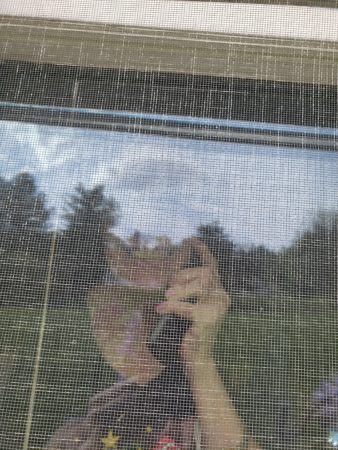
You are a GUI agent. You are given a task and a screenshot of the screen. Output one action in this format:
    pyautogui.click(x=<x>, y=<y>)
    Task: Click on the phone
    The image size is (338, 450).
    Given the screenshot: What is the action you would take?
    pyautogui.click(x=167, y=325)